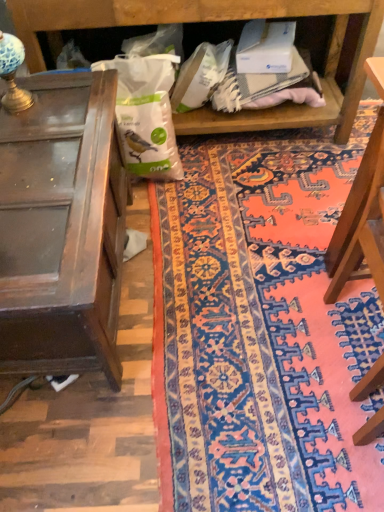
In order to click on vacant region above wooden table at left (from a real-world perspective) in this screenshot , I will do `click(54, 165)`.